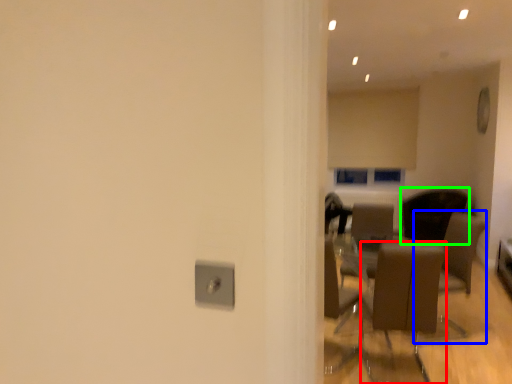
Question: Considering the real-world distances, which object is closest to chair (highlighted by a red box)? armchair (highlighted by a blue box) or chair (highlighted by a green box).

Choices:
 (A) armchair
 (B) chair

Answer: (A)